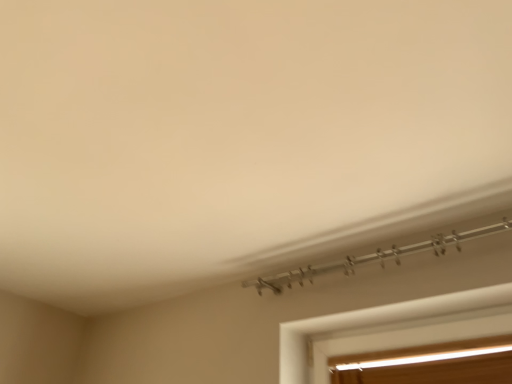
Question: From their relative heights in the image, would you say white matte window at lower right, the 1th window in the top-to-bottom sequence, is taller or shorter than clear glass window at lower right, which ranks as the 1th window in bottom-to-top order?

Choices:
 (A) tall
 (B) short

Answer: (B)

Question: Is point (479, 306) closer or farther from the camera than point (400, 375)?

Choices:
 (A) closer
 (B) farther

Answer: (A)

Question: In the image, is white matte window at lower right, the 1th window in the top-to-bottom sequence, positioned in front of or behind clear glass window at lower right, the second window in the top-to-bottom sequence?

Choices:
 (A) behind
 (B) front

Answer: (B)

Question: Looking at their shapes, would you say clear glass window at lower right, the second window in the top-to-bottom sequence, is wider or thinner than white matte window at lower right, the 1th window in the top-to-bottom sequence?

Choices:
 (A) wide
 (B) thin

Answer: (B)

Question: From the image's perspective, is clear glass window at lower right, which ranks as the 1th window in bottom-to-top order, located above or below white matte window at lower right, which ranks as the second window in bottom-to-top order?

Choices:
 (A) below
 (B) above

Answer: (A)

Question: Is point (377, 359) positioned closer to the camera than point (466, 297)?

Choices:
 (A) closer
 (B) farther

Answer: (B)

Question: Is clear glass window at lower right, the second window in the top-to-bottom sequence, inside or outside of white matte window at lower right, the 1th window in the top-to-bottom sequence?

Choices:
 (A) outside
 (B) inside

Answer: (A)